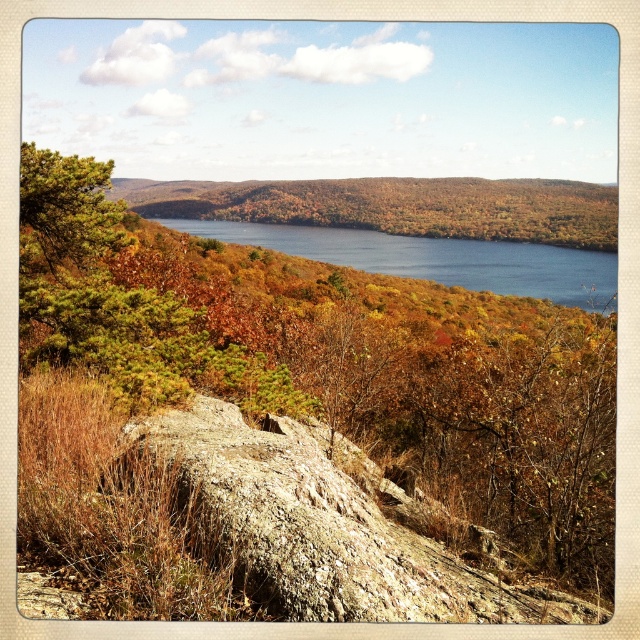
You are hiking and want to take a photo of both the autumn foliage at center and the green matte pine tree at upper left. Which direction should you move to ensure both are in your frame?

Move to your left so that the autumn foliage at center and the green matte pine tree at upper left are positioned side by side within your camera frame.

You are a hiker who wants to take a photo of the green matte pine tree at upper left without the brown rough rock at center blocking the view. Based on the scene, is there a way to position yourself so that the rock is not in front of the pine tree?

The brown rough rock at center is in front of the green matte pine tree at upper left, so you cannot position yourself to avoid the rock blocking the view of the pine tree.

You are an artist planning to paint this autumn landscape. You want to ensure the brown rough rock at center and the green matte pine tree at upper left are proportionally accurate. Which object should you paint as taller?

The green matte pine tree at upper left should be painted as taller because the brown rough rock at center is not as tall as the green matte pine tree at upper left.